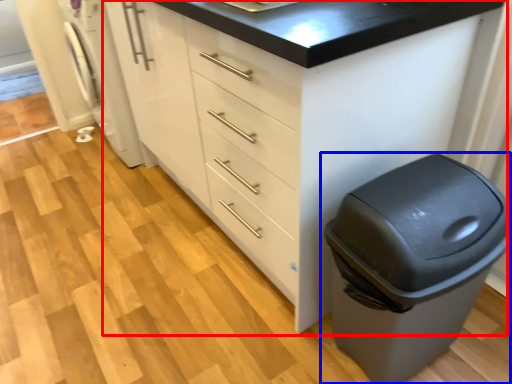
Question: Which object is closer to the camera taking this photo, chest of drawers (highlighted by a red box) or waste container (highlighted by a blue box)?

Choices:
 (A) chest of drawers
 (B) waste container

Answer: (A)